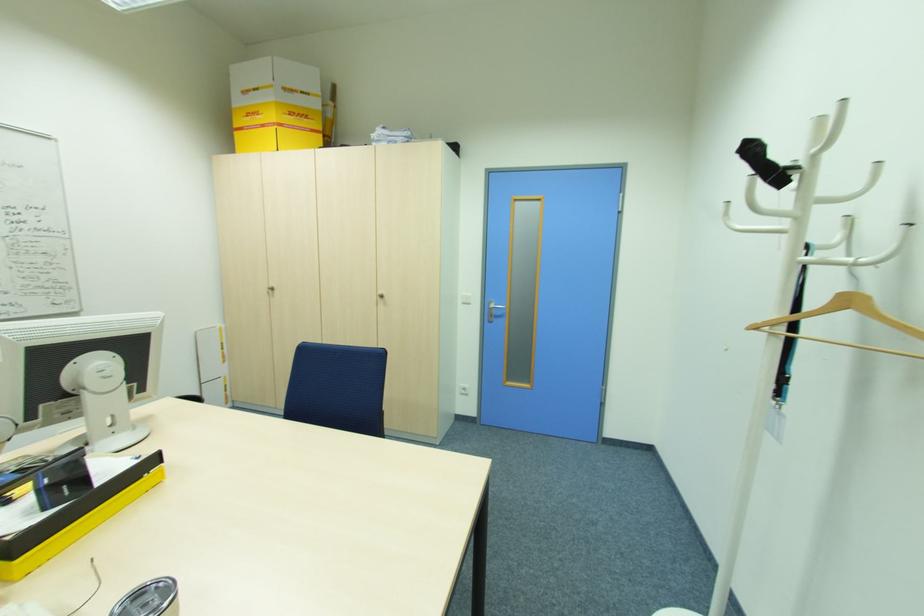
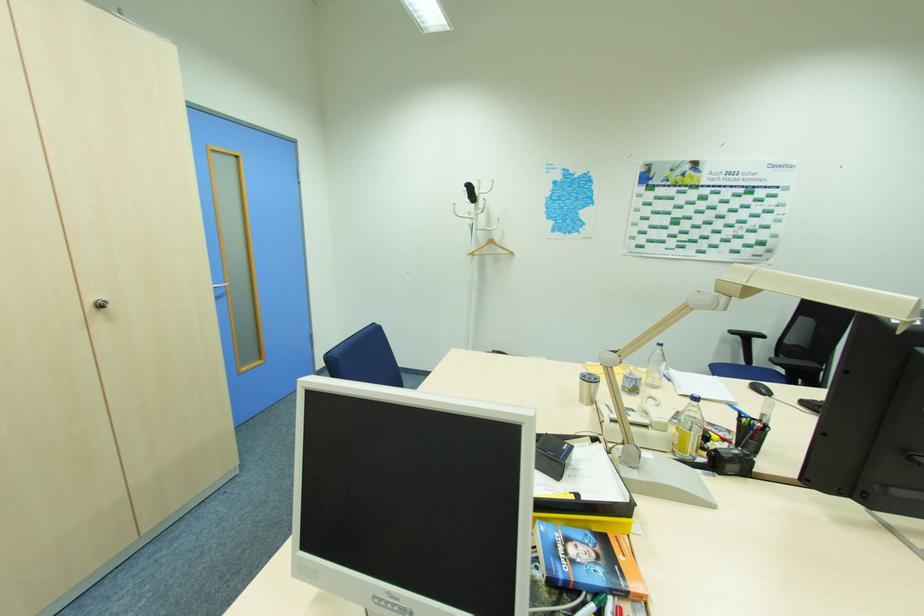
Where in the second image is the point corresponding to [854,257] from the first image?

(492, 229)